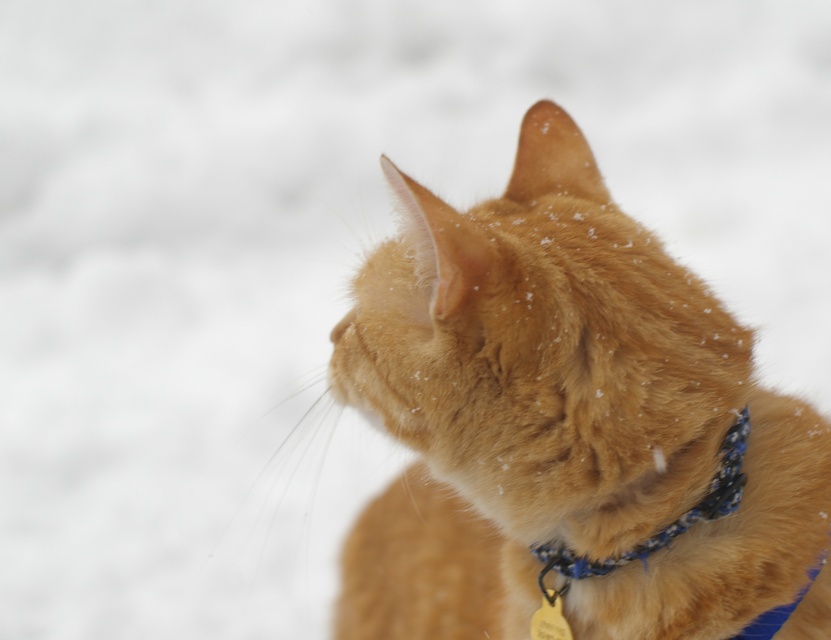
Question: Which point is farther from the camera taking this photo?

Choices:
 (A) (461, 285)
 (B) (736, 440)

Answer: (B)

Question: Which point is closer to the camera?

Choices:
 (A) orange fur cat at center
 (B) blue fabric neckband at center

Answer: (A)

Question: Is orange fur cat at center wider than blue fabric neckband at center?

Choices:
 (A) yes
 (B) no

Answer: (A)

Question: Does orange fur cat at center appear over blue fabric neckband at center?

Choices:
 (A) yes
 (B) no

Answer: (A)

Question: Does orange fur cat at center lie in front of blue fabric neckband at center?

Choices:
 (A) yes
 (B) no

Answer: (A)